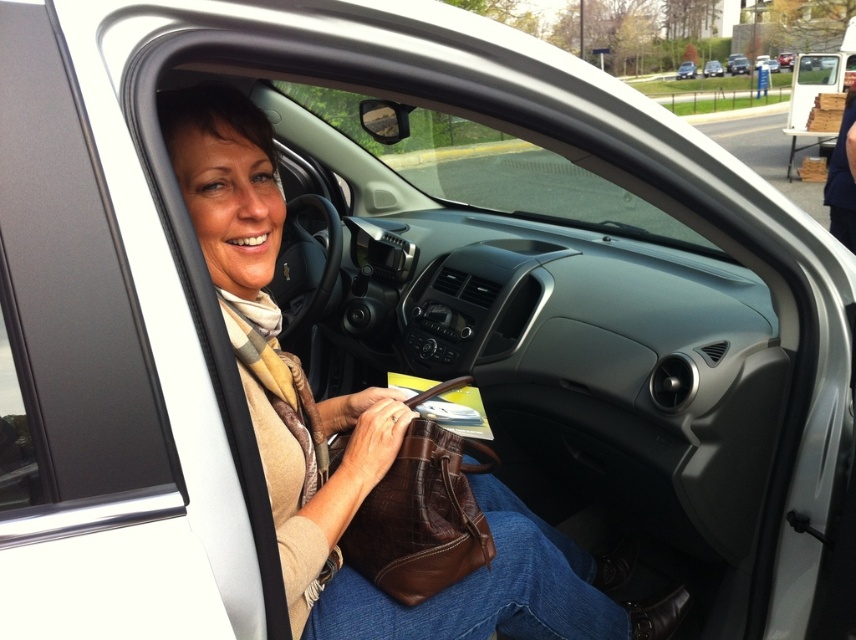
Question: Does brown leather purse at center have a smaller size compared to white matte car at center?

Choices:
 (A) yes
 (B) no

Answer: (B)

Question: Does brown leather handbag at center appear over white matte car at center?

Choices:
 (A) no
 (B) yes

Answer: (A)

Question: Estimate the real-world distances between objects in this image. Which object is farther from the silver metallic sedan at upper center?

Choices:
 (A) metallic silver sedan at center
 (B) brown leather purse at center
 (C) brown leather handbag at center

Answer: (C)

Question: Is brown leather purse at center to the right of metallic silver sedan at center from the viewer's perspective?

Choices:
 (A) yes
 (B) no

Answer: (B)

Question: Which of the following is the closest to the observer?

Choices:
 (A) (715, 60)
 (B) (191, 113)

Answer: (B)

Question: Which point appears closest to the camera in this image?

Choices:
 (A) (714, 72)
 (B) (376, 548)
 (C) (693, 72)
 (D) (572, 620)

Answer: (B)